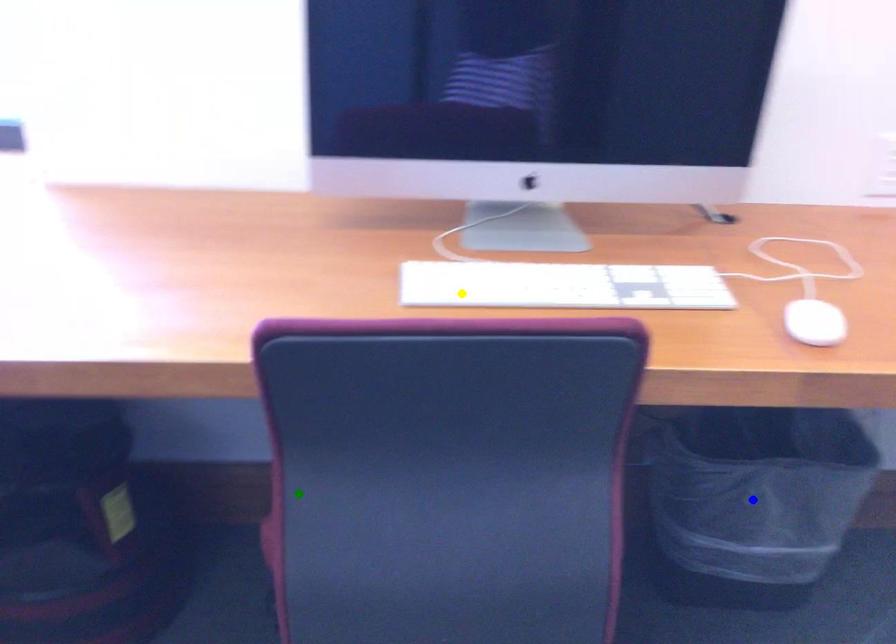
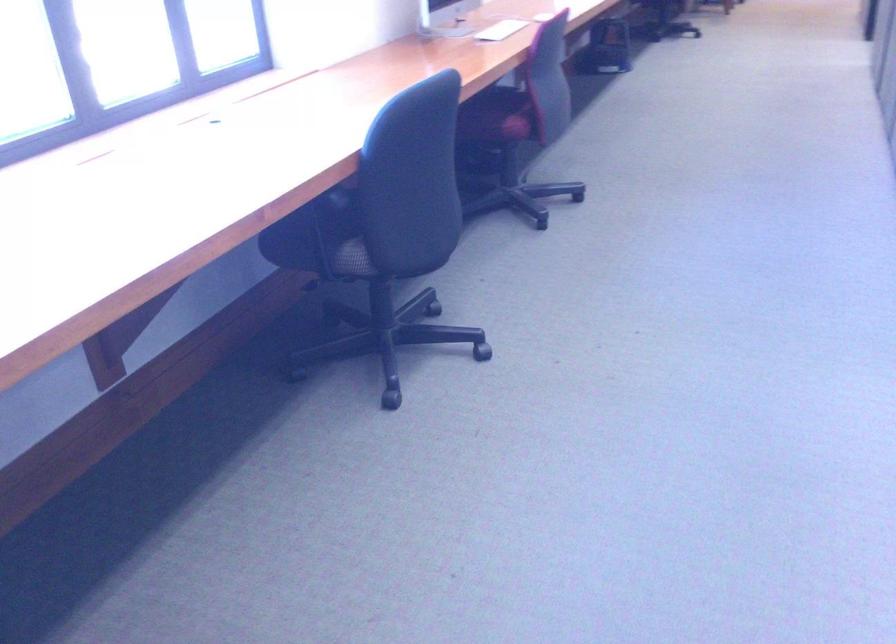
I am providing you with two images of the same scene from different viewpoints. Three points are marked in image1. Which point corresponds to a part or object that is occluded in image2?In image1, three points are marked. Which of them correspond to a part or object that is occluded in image2?Among the three points shown in image1, which one corresponds to a part or object that is no longer visible due to occlusion in image2?

blue point cannot be seen in image2.